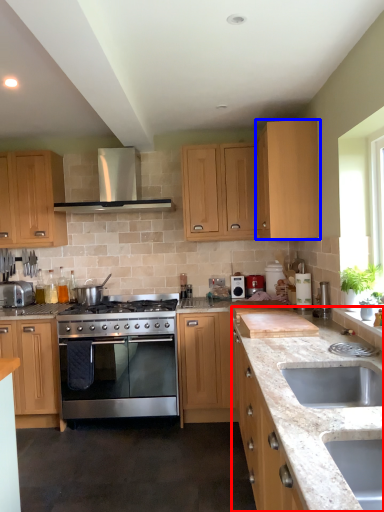
Question: Which object is closer to the camera taking this photo, counter (highlighted by a red box) or cabinetry (highlighted by a blue box)?

Choices:
 (A) counter
 (B) cabinetry

Answer: (A)